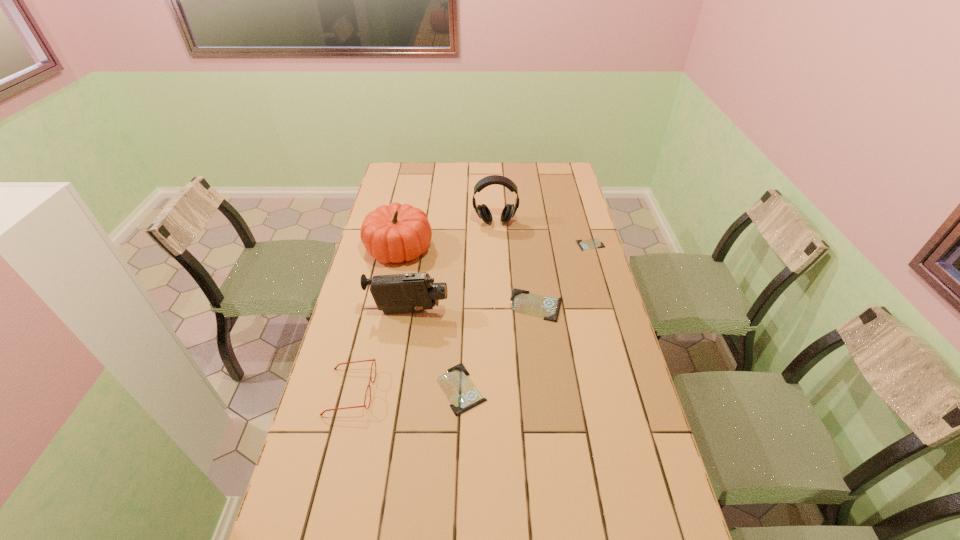
Identify the location of free space at the far edge of the desktop. (447, 170).

In the image, there is a desktop. At what (x,y) coordinates should I click in order to perform the action: click on free space at the left edge. Please return your answer as a coordinate pair (x, y). Image resolution: width=960 pixels, height=540 pixels. Looking at the image, I should click on (327, 448).

Find the location of `free space at the right edge of the desktop`. free space at the right edge of the desktop is located at coordinates (618, 435).

At what (x,y) coordinates should I click in order to perform the action: click on vacant point at the far left corner. Please return your answer as a coordinate pair (x, y). The height and width of the screenshot is (540, 960). Looking at the image, I should click on (396, 178).

This screenshot has width=960, height=540. Identify the location of vacant region at the far right corner of the desktop. (558, 178).

Where is `empty location between the fourth shortest object and the camcorder`? The image size is (960, 540). empty location between the fourth shortest object and the camcorder is located at coordinates (379, 352).

Locate an element on the screen. vacant area that lies between the spectacles and the rightmost object is located at coordinates (470, 318).

The image size is (960, 540). Identify the location of free space between the second shortest object and the earphone. [478, 306].

This screenshot has height=540, width=960. I want to click on free area in between the pumpkin and the earphone, so click(447, 235).

Find the location of `unoccupied area between the nearest identity card and the fourth tallest object`. unoccupied area between the nearest identity card and the fourth tallest object is located at coordinates (406, 390).